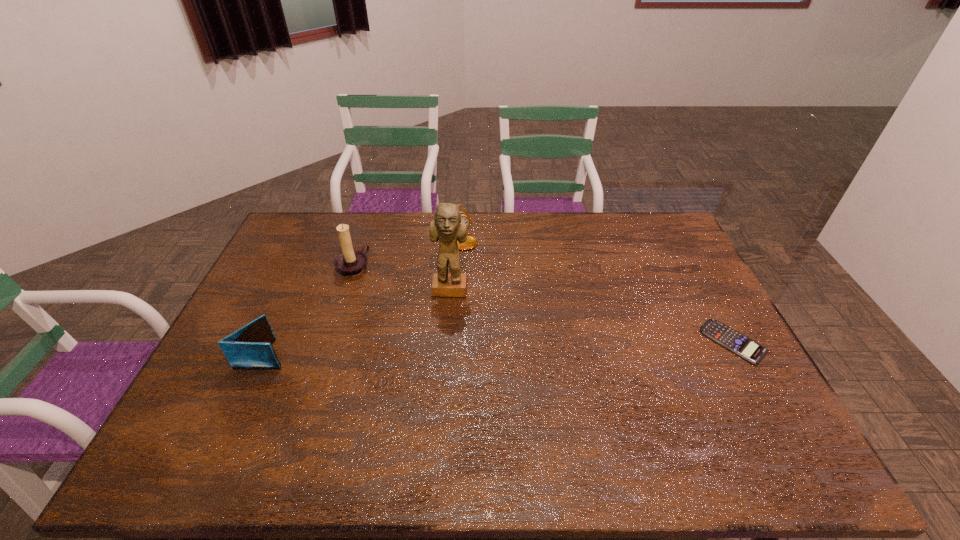
Where is `the closest object to the figurine`? the closest object to the figurine is located at coordinates (471, 242).

Find the location of a particular element. This screenshot has height=540, width=960. vacant point that satisfies the following two spatial constraints: 1. on the back side of the fourth shortest object; 2. on the left side of the farthest object is located at coordinates (363, 238).